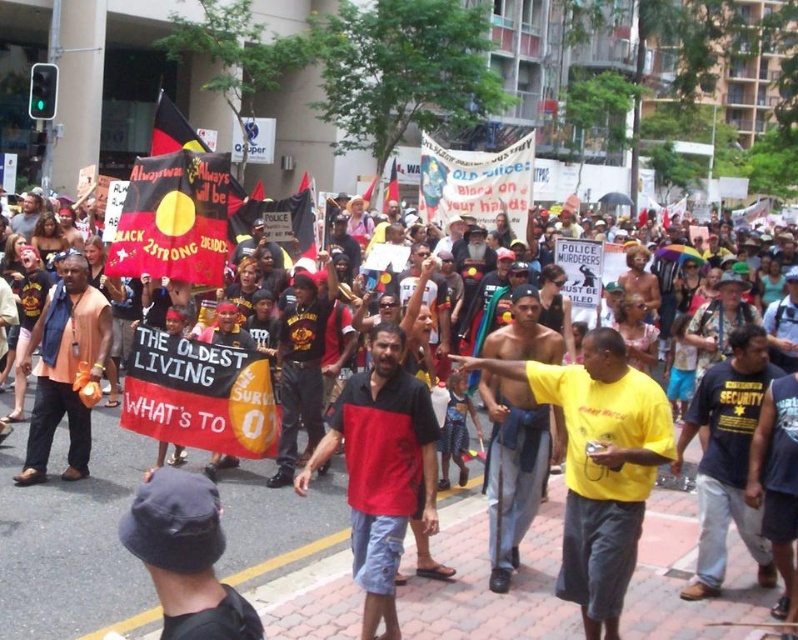
Can you confirm if red/black shirt at center is shorter than red fabric flag at center?

Indeed, red/black shirt at center has a lesser height compared to red fabric flag at center.

In the scene shown: How far apart are red/black shirt at center and red fabric flag at center?

red/black shirt at center is 16.83 meters away from red fabric flag at center.

Is point (362, 582) positioned behind point (394, 173)?

No, it is in front of (394, 173).

The width and height of the screenshot is (798, 640). In order to click on red/black shirt at center in this screenshot , I will do `click(381, 468)`.

Is the position of red/black shirt at center less distant than that of red fabric flag at upper left?

That is True.

Who is more forward, [409,387] or [147,156]?

Point [409,387]

The image size is (798, 640). Find the location of `red/black shirt at center`. red/black shirt at center is located at coordinates (381, 468).

Which is below, yellow cotton shirt at center or red/black shirt at center?

Positioned lower is yellow cotton shirt at center.

Measure the distance between point [583,593] and camera.

The distance of point [583,593] from camera is 4.75 meters.

Between point (607, 552) and point (366, 516), which one is positioned in front?

Point (607, 552)

At what (x,y) coordinates should I click in order to perform the action: click on yellow cotton shirt at center. Please return your answer as a coordinate pair (x, y). Image resolution: width=798 pixels, height=640 pixels. Looking at the image, I should click on (599, 467).